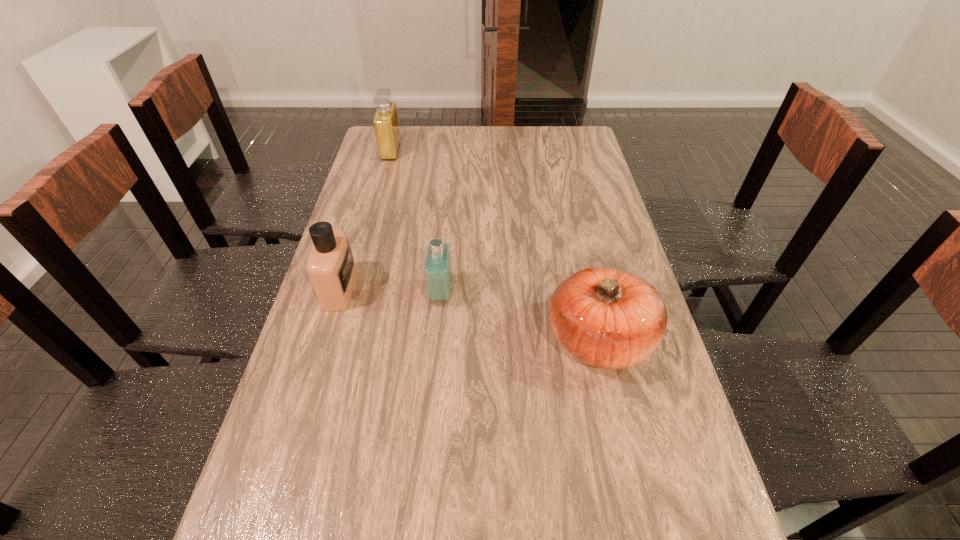
You are a GUI agent. You are given a task and a screenshot of the screen. Output one action in this format:
    pyautogui.click(x=<x>, y=<y>)
    Task: Click on the farthest object
    This screenshot has width=960, height=540.
    Given the screenshot: What is the action you would take?
    pyautogui.click(x=386, y=123)

The width and height of the screenshot is (960, 540). Identify the location of pumpkin. (608, 318).

What are the coordinates of `the rightmost perfume` in the screenshot? It's located at (438, 269).

Locate an element on the screen. Image resolution: width=960 pixels, height=540 pixels. the shortest perfume is located at coordinates (438, 269).

Where is `free location located 0.380m on the front-facing side of the farthest object`? This screenshot has width=960, height=540. free location located 0.380m on the front-facing side of the farthest object is located at coordinates (499, 151).

You are a GUI agent. You are given a task and a screenshot of the screen. Output one action in this format:
    pyautogui.click(x=<x>, y=<y>)
    Task: Click on the vacant space positioned on the back of the pumpkin
    The image size is (960, 540).
    Given the screenshot: What is the action you would take?
    pyautogui.click(x=587, y=284)

Where is `vacant space situated 0.300m on the front label of the third object from left to right`? vacant space situated 0.300m on the front label of the third object from left to right is located at coordinates (566, 294).

Find the location of a particular element. This screenshot has height=540, width=960. object that is at the far edge is located at coordinates (386, 123).

The height and width of the screenshot is (540, 960). What are the coordinates of `object located at the right edge` in the screenshot? It's located at (608, 318).

Identify the location of object at the far left corner. Image resolution: width=960 pixels, height=540 pixels. (386, 123).